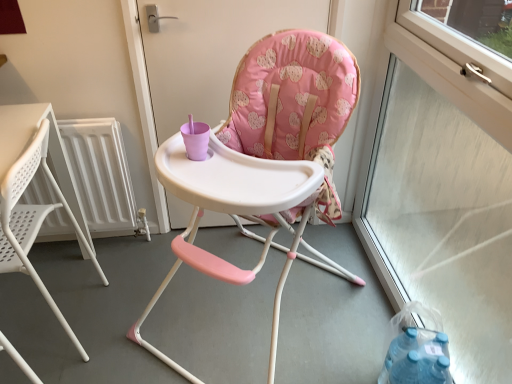
I want to click on vacant space underneath white plastic chair at left, acting as the 2th chair starting from the right (from a real-world perspective), so click(50, 320).